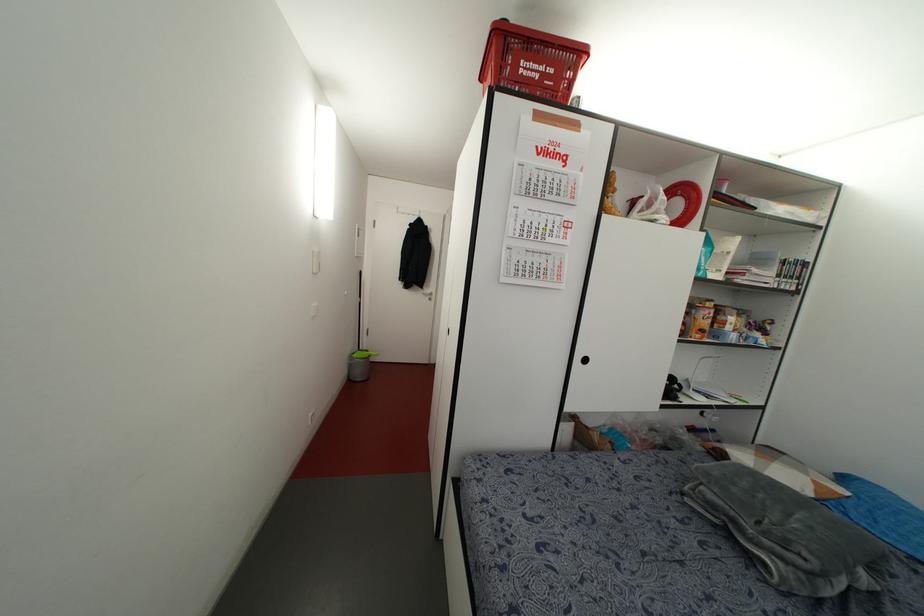
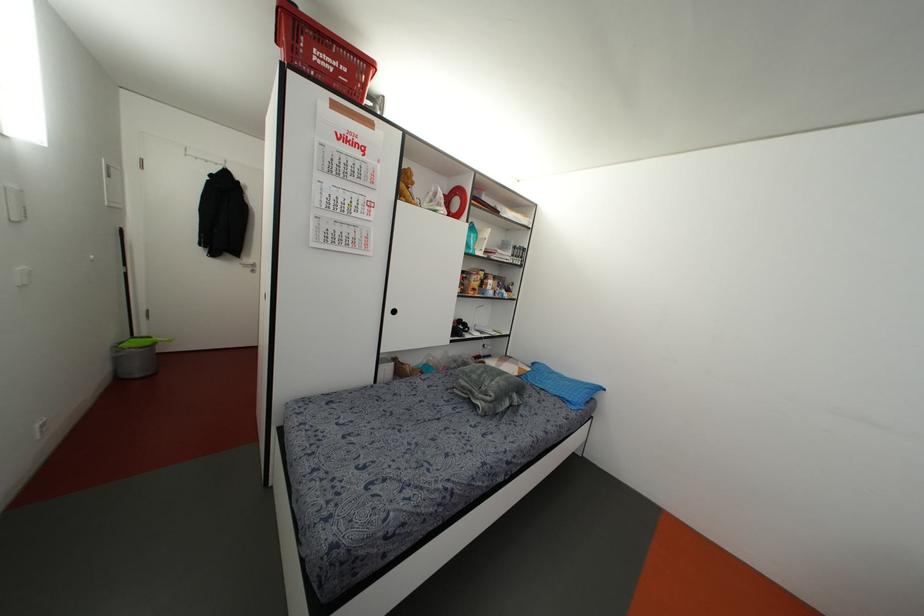
Locate, in the second image, the point that corresponds to point 429,299 in the first image.

(252, 270)